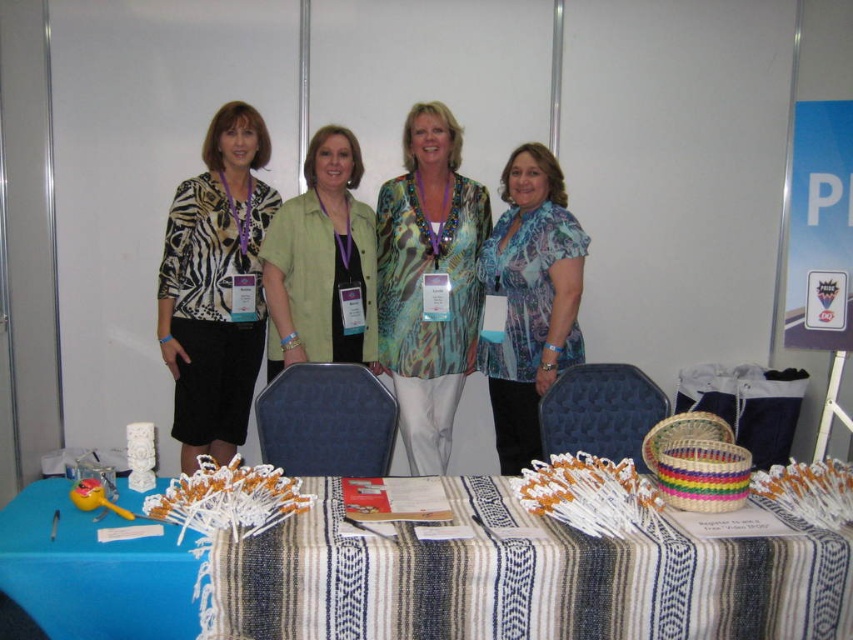
Is point (438, 356) positioned in front of point (306, 333)?

No.

Which is behind, point (396, 250) or point (318, 326)?

Point (396, 250)

Is point (445, 157) behind point (285, 316)?

Yes, it is.

The image size is (853, 640). I want to click on printed silk blouse at center, so coord(422,278).

Consider the image. Does printed silk blouse at center appear on the left side of blue sheer blouse at center?

Yes, printed silk blouse at center is to the left of blue sheer blouse at center.

Which is behind, point (386, 209) or point (503, 422)?

Point (503, 422)

This screenshot has height=640, width=853. Identify the location of printed silk blouse at center. (422, 278).

Who is taller, blue striped tablecloth at center or printed silk blouse at center?

With more height is printed silk blouse at center.

Is blue striped tablecloth at center wider than printed silk blouse at center?

Correct, the width of blue striped tablecloth at center exceeds that of printed silk blouse at center.

What do you see at coordinates (419, 579) in the screenshot? I see `blue striped tablecloth at center` at bounding box center [419, 579].

You are a GUI agent. You are given a task and a screenshot of the screen. Output one action in this format:
    pyautogui.click(x=<x>, y=<y>)
    Task: Click on the blue striped tablecloth at center
    Image resolution: width=853 pixels, height=640 pixels.
    Given the screenshot: What is the action you would take?
    pyautogui.click(x=419, y=579)